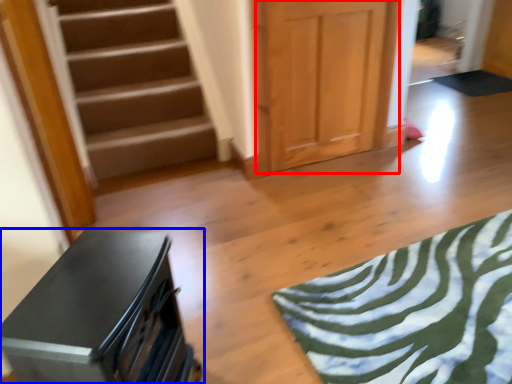
Question: Among these objects, which one is nearest to the camera, door (highlighted by a red box) or furniture (highlighted by a blue box)?

Choices:
 (A) door
 (B) furniture

Answer: (B)